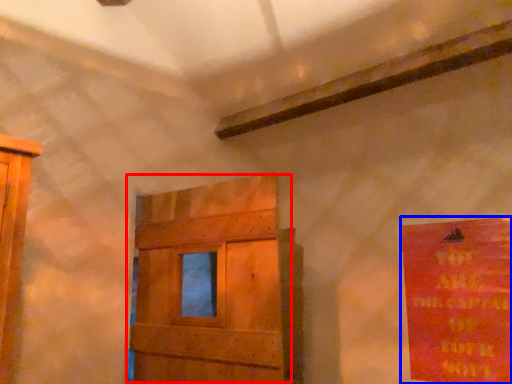
Question: Among these objects, which one is farthest to the camera, door (highlighted by a red box) or poster (highlighted by a blue box)?

Choices:
 (A) door
 (B) poster

Answer: (B)